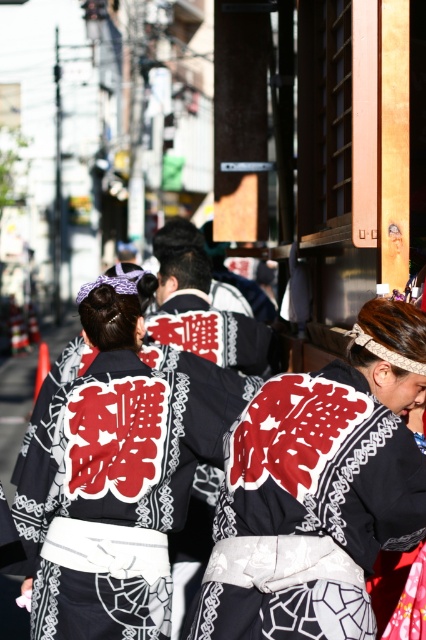
You are standing at point (x=175, y=454) and want to walk to point (x=350, y=456). Is the destination point in front of or behind you?

The destination point (x=350, y=456) is in front of you since it is positioned in front of point (x=175, y=454) where you are standing.

What are the coordinates of the black fabric kimono at center?

The black fabric kimono at center is located at coordinates point (319, 492).

You are a photographer standing 1.5 meters away from the black fabric kimono at center and the black silk kimono at center. Can you fit both kimonos in your camera frame if your camera has a maximum horizontal field of view of 1 meter?

The black fabric kimono at center is 80.07 centimeters away from the black silk kimono at center. Since the distance between them is less than the camera frame width of 1 meter, both kimonos can be captured in the frame.